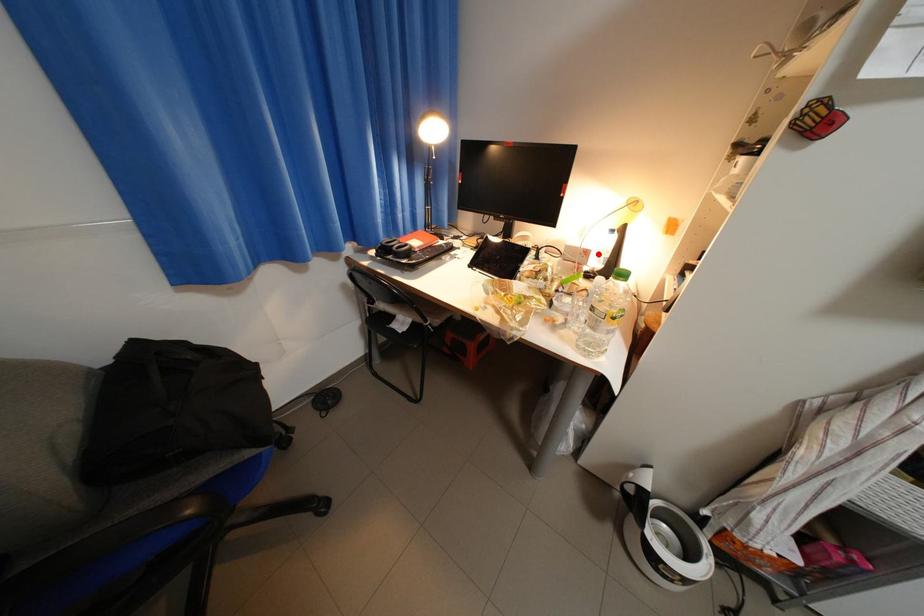
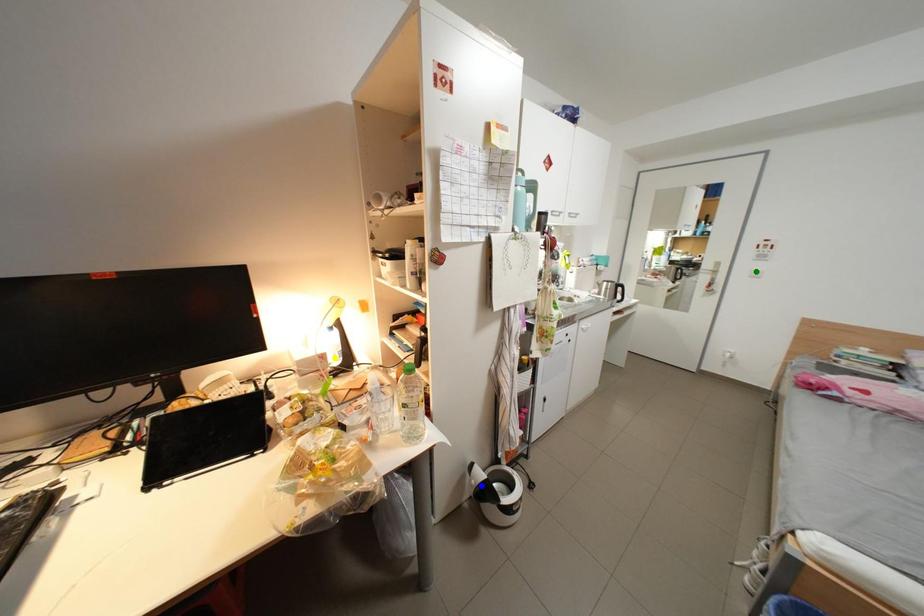
Question: I am providing you with two images of the same scene from different viewpoints. A red point is marked on the first image. You are given multiple points on the second image. Which spot in image 2 lines up with the point in image 1?

Choices:
 (A) blue point
 (B) yellow point
 (C) green point

Answer: (B)